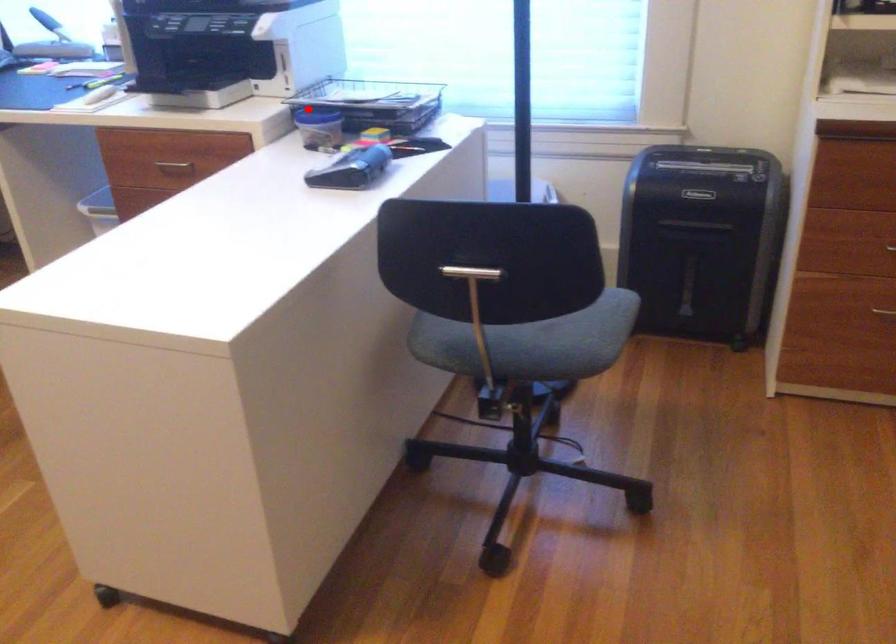
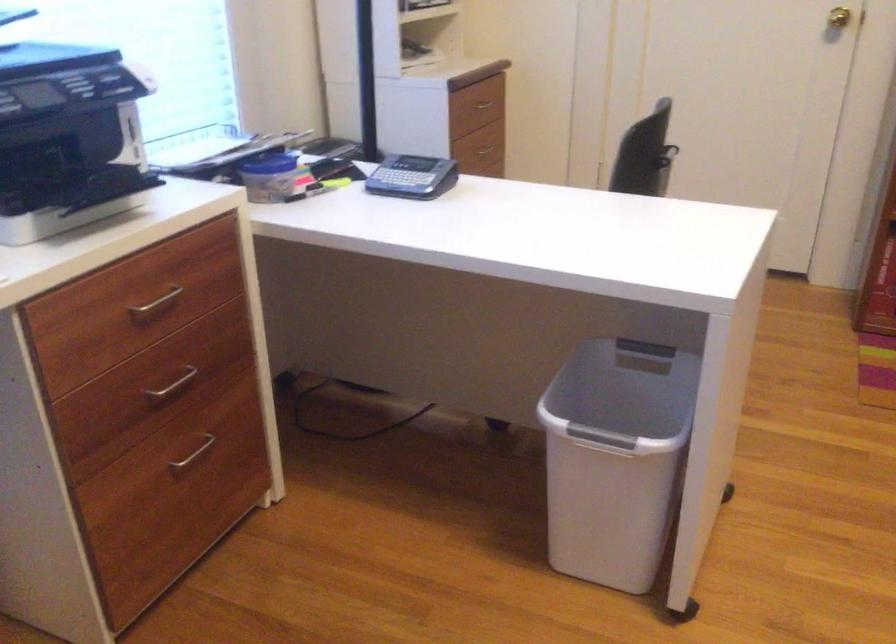
Question: I am providing you with two images of the same scene from different viewpoints. A red point is shown in image1. For the corresponding object point in image2, is it positioned nearer or farther from the camera?

Choices:
 (A) Nearer
 (B) Farther

Answer: (A)